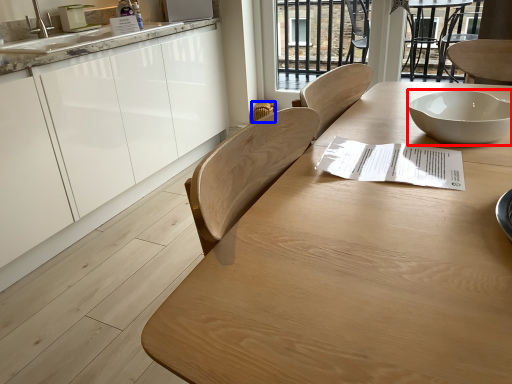
Question: Which of the following is the farthest to the observer, bowl (highlighted by a red box) or chair (highlighted by a blue box)?

Choices:
 (A) bowl
 (B) chair

Answer: (B)